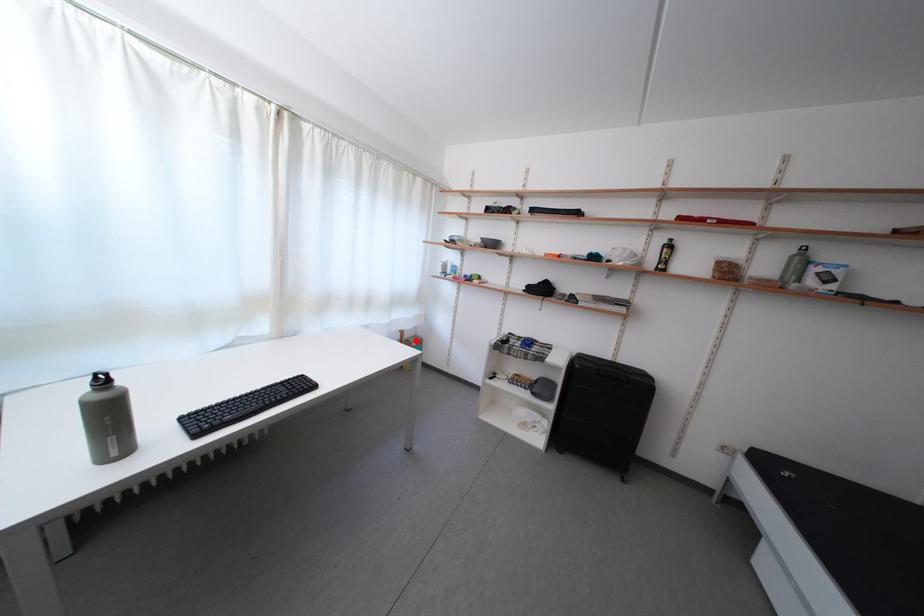
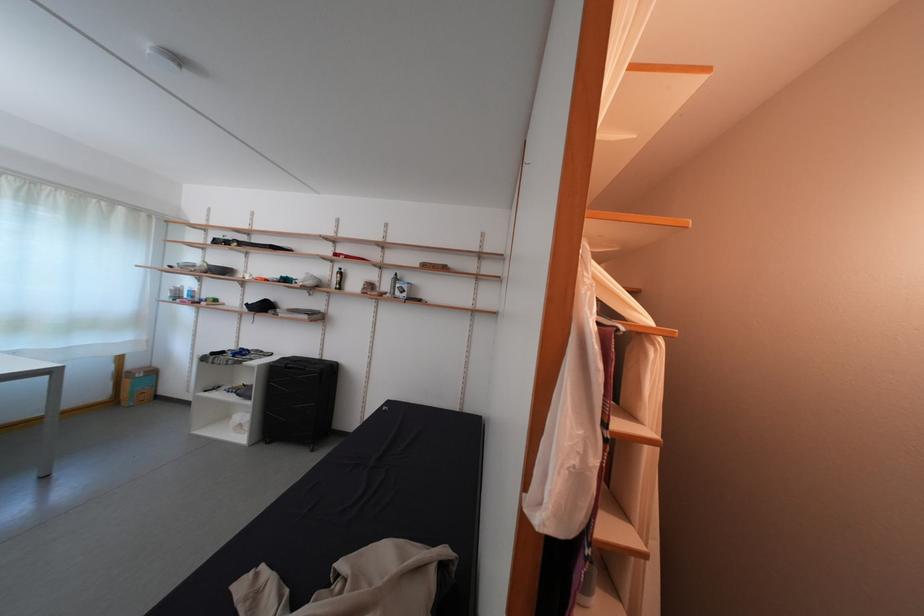
Question: A red point is marked in image1. In image2, is the corresponding 3D point closer to the camera or farther? Reply with the corresponding letter.

Choices:
 (A) The corresponding 3D point is closer.
 (B) The corresponding 3D point is farther.

Answer: (A)